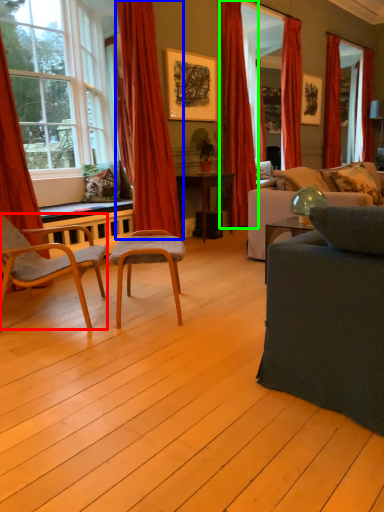
Question: Which is farther away from chair (highlighted by a red box)? curtain (highlighted by a blue box) or curtain (highlighted by a green box)?

Choices:
 (A) curtain
 (B) curtain

Answer: (B)